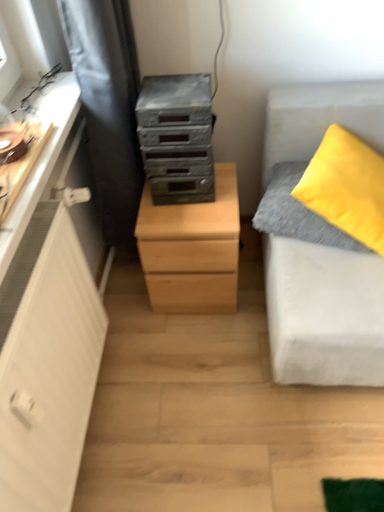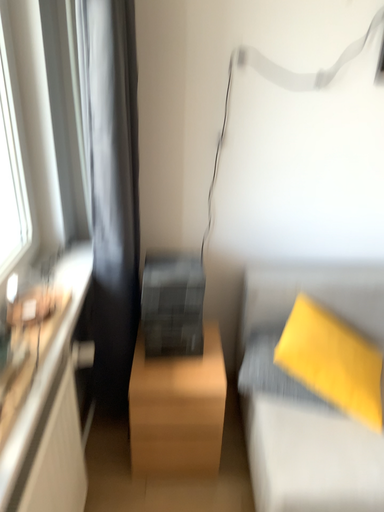
Question: How did the camera likely rotate when shooting the video?

Choices:
 (A) rotated downward
 (B) rotated upward

Answer: (B)